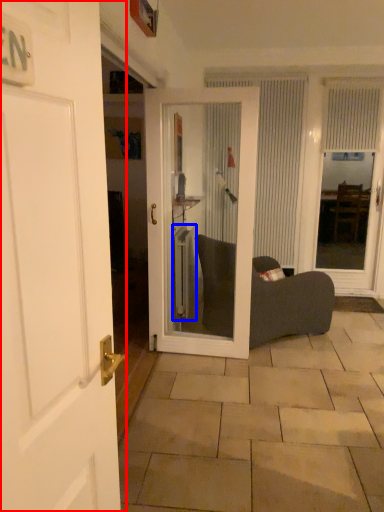
Question: Which object appears closest to the camera in this image, door (highlighted by a red box) or radiator (highlighted by a blue box)?

Choices:
 (A) door
 (B) radiator

Answer: (A)